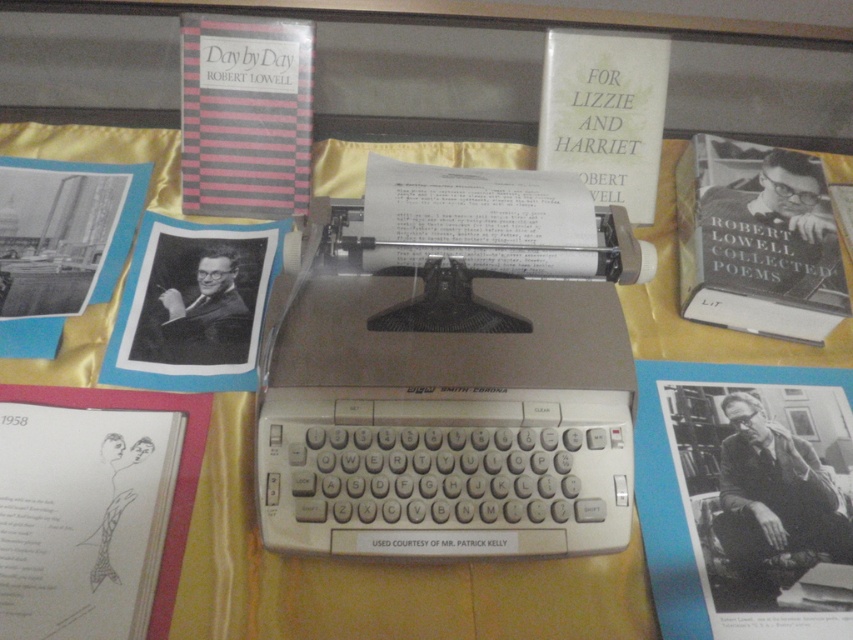
What is located at the coordinates point (x=746, y=499)?

The black paper book at center is located at point (x=746, y=499).

You are a photographer standing at the camera position. You want to take a closeup shot of the black paper book at center. Can you move closer than 27.19 inches to the book to get a better closeup?

The distance between the black paper book at center and the camera is 27.19 inches. Since you are at the camera position, you cannot move closer than that distance to the book because the camera is already positioned at that specific distance from the book.